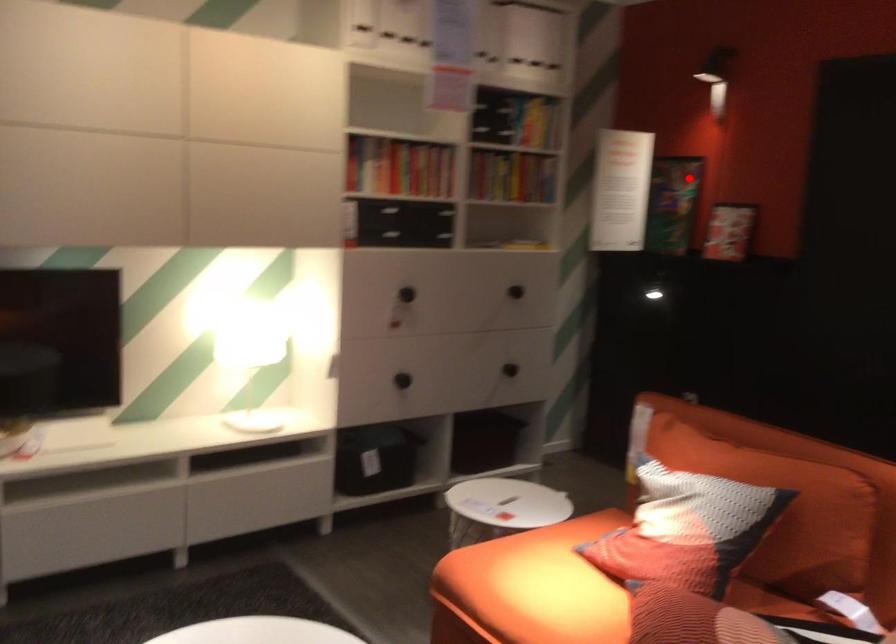
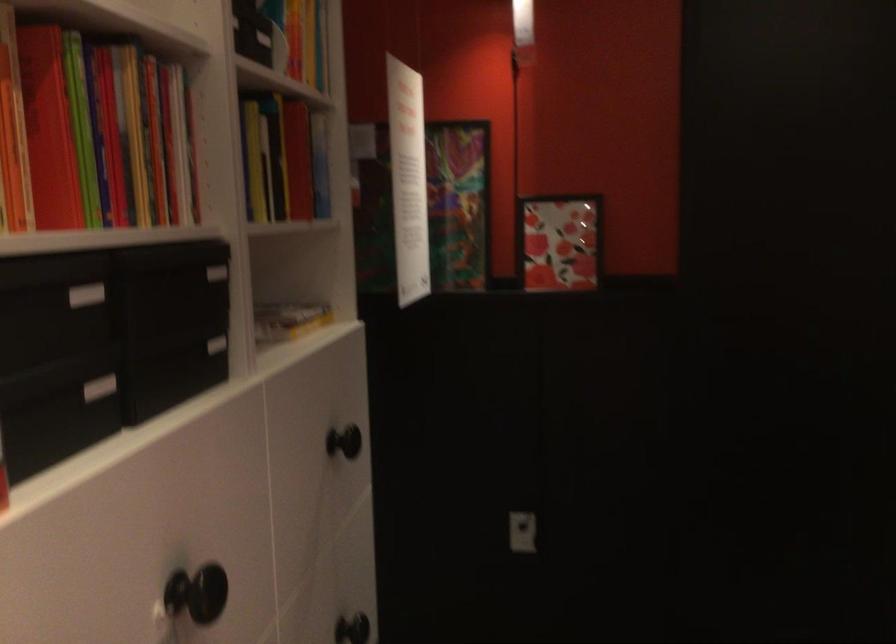
Question: I am providing you with two images of the same scene from different viewpoints. Given a red point in image1, look at the same physical point in image2. Is it:

Choices:
 (A) Closer to the viewpoint
 (B) Farther from the viewpoint

Answer: (A)